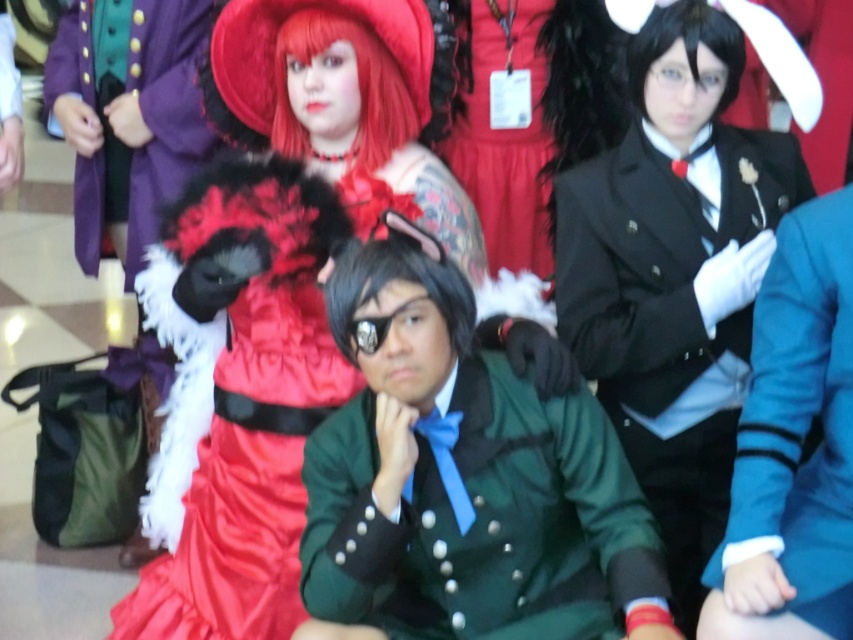
Question: Can you confirm if satin red dress at upper center is positioned above teal wool blazer at right?

Choices:
 (A) yes
 (B) no

Answer: (A)

Question: Is black satin blazer at upper right wider than teal wool blazer at right?

Choices:
 (A) yes
 (B) no

Answer: (A)

Question: Which object is farther from the camera taking this photo?

Choices:
 (A) green satin uniform at center
 (B) black satin blazer at upper right
 (C) teal wool blazer at right

Answer: (B)

Question: Which is farther from the black satin blazer at upper right?

Choices:
 (A) teal wool blazer at right
 (B) green satin uniform at center
 (C) satin red dress at upper center

Answer: (C)

Question: From the image, what is the correct spatial relationship of satin red dress at upper center in relation to green satin uniform at center?

Choices:
 (A) right
 (B) left

Answer: (B)

Question: Which point is farther from the camera taking this photo?

Choices:
 (A) (740, 616)
 (B) (595, 296)
 (C) (207, 228)
 (D) (498, 634)

Answer: (B)